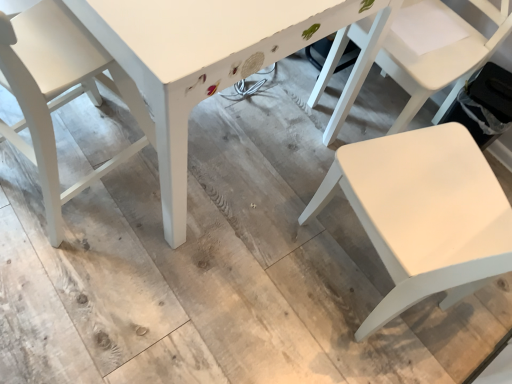
Question: Is white matte chair at left, which is counted as the 1th chair, starting from the left, behind white matte chair at right, placed as the 1th chair when sorted from right to left?

Choices:
 (A) no
 (B) yes

Answer: (A)

Question: Does white matte chair at left, which is counted as the 1th chair, starting from the left, come in front of white matte chair at right, placed as the 1th chair when sorted from right to left?

Choices:
 (A) no
 (B) yes

Answer: (B)

Question: Is white matte chair at left, which is counted as the 1th chair, starting from the left, positioned far away from white matte chair at right, the 3th chair in the left-to-right sequence?

Choices:
 (A) no
 (B) yes

Answer: (A)

Question: Could you tell me if white matte chair at left, acting as the third chair starting from the right, is facing white matte chair at right, placed as the 1th chair when sorted from right to left?

Choices:
 (A) yes
 (B) no

Answer: (B)

Question: Does white matte chair at left, which is counted as the 1th chair, starting from the left, have a lesser width compared to white matte chair at right, the 3th chair in the left-to-right sequence?

Choices:
 (A) no
 (B) yes

Answer: (B)

Question: Could white matte chair at right, placed as the 1th chair when sorted from right to left, be considered to be inside white matte chair at left, acting as the third chair starting from the right?

Choices:
 (A) no
 (B) yes

Answer: (A)

Question: Is white matte chair at left, acting as the third chair starting from the right, completely or partially outside of white painted wood table at center?

Choices:
 (A) yes
 (B) no

Answer: (B)

Question: Would you consider white matte chair at left, acting as the third chair starting from the right, to be distant from white painted wood table at center?

Choices:
 (A) no
 (B) yes

Answer: (A)

Question: From a real-world perspective, is white matte chair at left, which is counted as the 1th chair, starting from the left, over white painted wood table at center?

Choices:
 (A) yes
 (B) no

Answer: (A)

Question: Does white matte chair at left, acting as the third chair starting from the right, turn towards white painted wood table at center?

Choices:
 (A) yes
 (B) no

Answer: (A)

Question: Can you confirm if white matte chair at left, acting as the third chair starting from the right, is taller than white painted wood table at center?

Choices:
 (A) no
 (B) yes

Answer: (B)

Question: Is white matte chair at left, which is counted as the 1th chair, starting from the left, positioned behind white painted wood table at center?

Choices:
 (A) no
 (B) yes

Answer: (A)

Question: Is white painted wood table at center positioned with its back to white matte chair at right, the 3th chair in the left-to-right sequence?

Choices:
 (A) no
 (B) yes

Answer: (B)